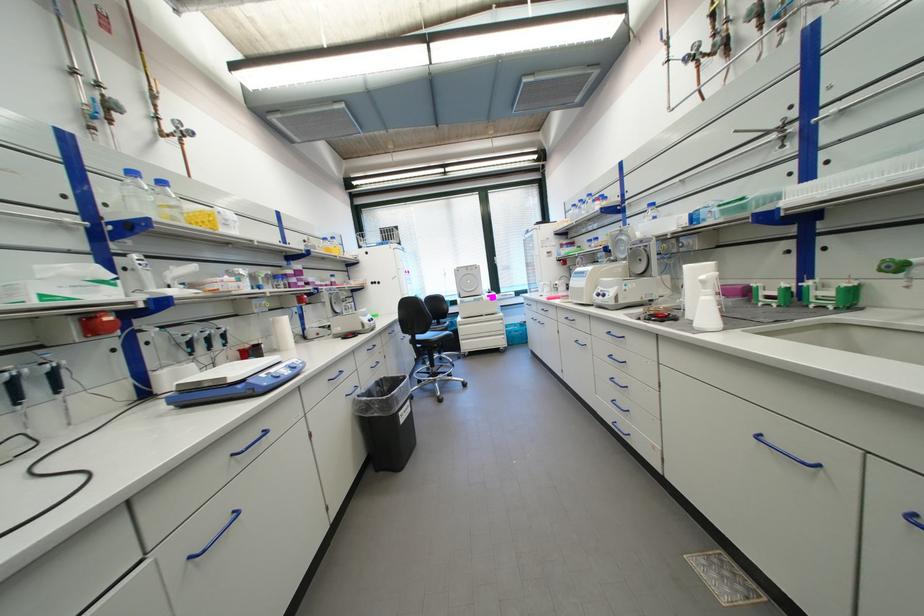
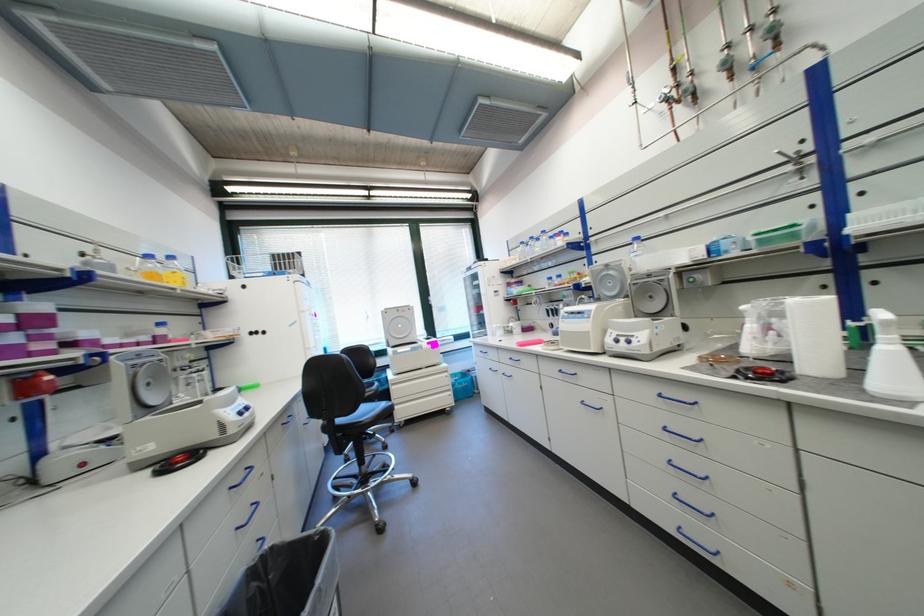
The images are taken continuously from a first-person perspective. In which direction are you moving?

The movement direction of the cameraman is left, forward.